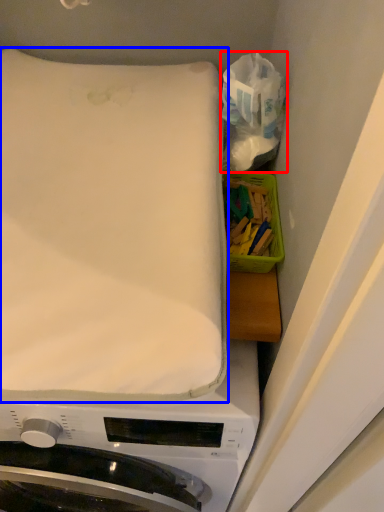
Question: Which point is closer to the camera, tissue (highlighted by a red box) or mattress (highlighted by a blue box)?

Choices:
 (A) tissue
 (B) mattress

Answer: (B)